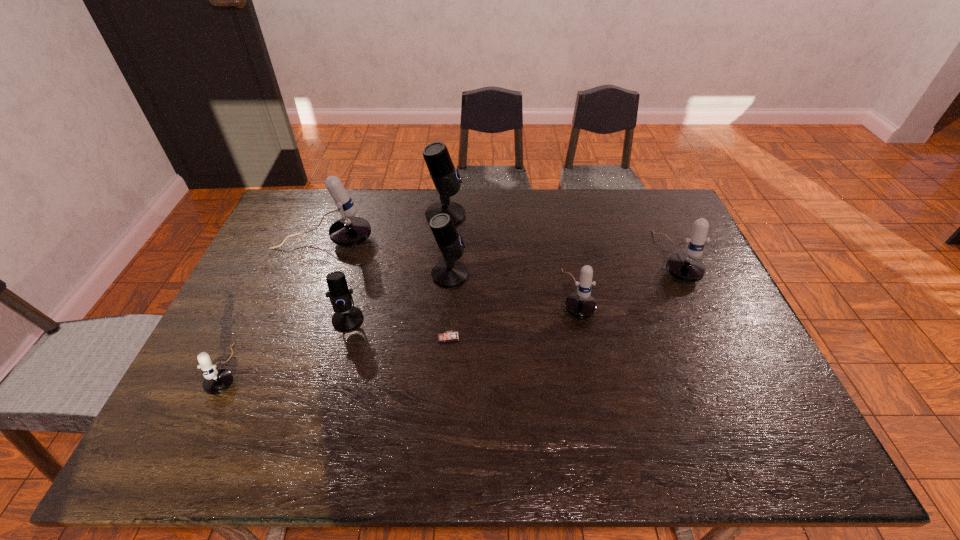
At what (x,y) coordinates should I click in order to perform the action: click on vacant point located 0.090m on the front of the shortest microphone. Please return your answer as a coordinate pair (x, y). The height and width of the screenshot is (540, 960). Looking at the image, I should click on (199, 435).

The image size is (960, 540). I want to click on free spot located 0.050m on the back of the shortest object, so click(x=449, y=317).

You are a GUI agent. You are given a task and a screenshot of the screen. Output one action in this format:
    pyautogui.click(x=<x>, y=<y>)
    Task: Click on the object that is positioned at the right edge
    
    Given the screenshot: What is the action you would take?
    pyautogui.click(x=687, y=267)

Where is `object at the far left corner`? object at the far left corner is located at coordinates (350, 230).

Identify the location of free space at the far edge of the desktop. (487, 197).

Image resolution: width=960 pixels, height=540 pixels. In order to click on free space at the near edge in this screenshot , I will do `click(564, 437)`.

At what (x,y) coordinates should I click in order to perform the action: click on free space at the left edge. Please return your answer as a coordinate pair (x, y). The image size is (960, 540). Looking at the image, I should click on (290, 280).

Find the location of a particular element. The width and height of the screenshot is (960, 540). vacant region at the right edge of the desktop is located at coordinates (758, 393).

In the image, there is a desktop. Where is `vacant space at the far left corner`? The image size is (960, 540). vacant space at the far left corner is located at coordinates [x=288, y=214].

The image size is (960, 540). In order to click on free spot between the rightmost white microphone and the second farthest black microphone in this screenshot , I will do tap(562, 266).